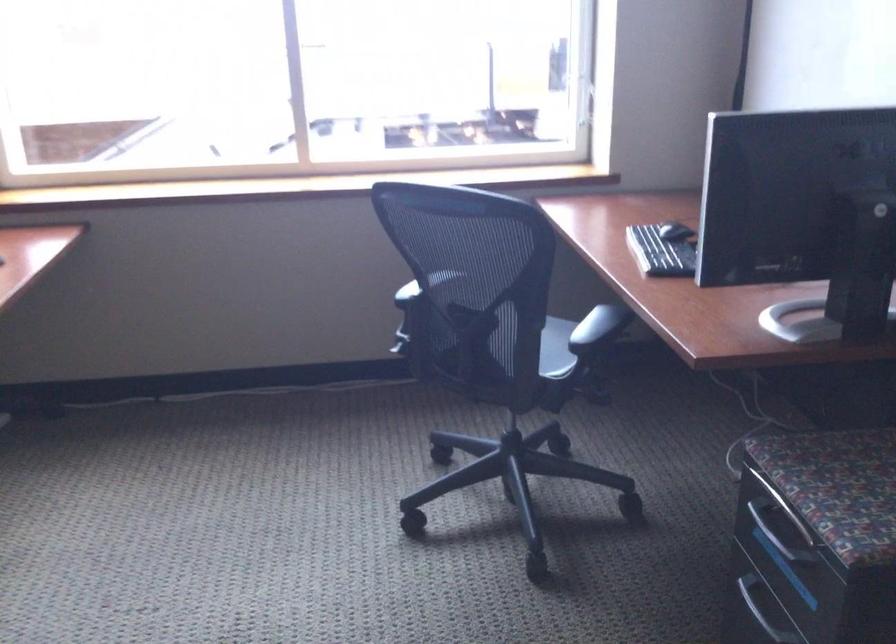
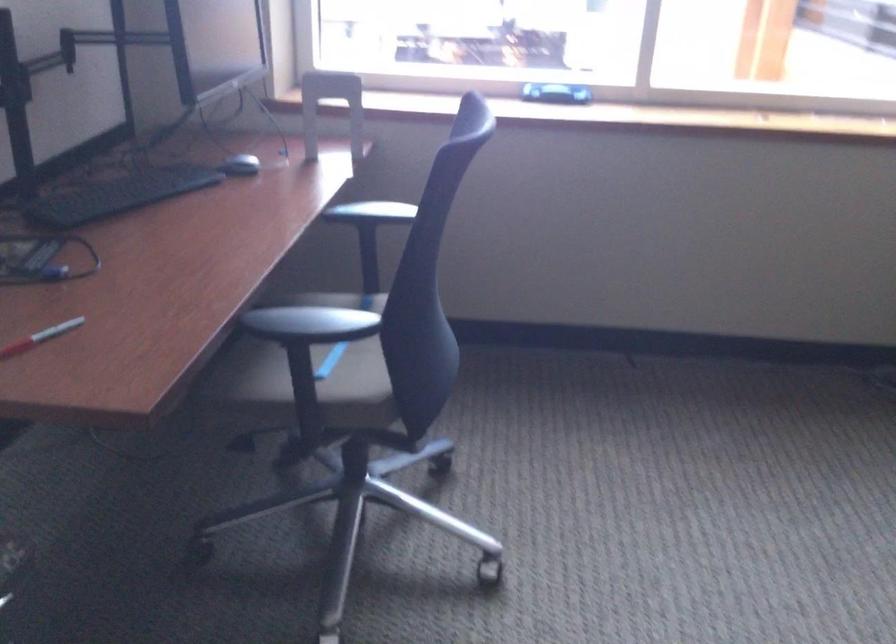
Question: The images are taken continuously from a first-person perspective. In which direction are you moving?

Choices:
 (A) Left
 (B) Right
 (C) Forward
 (D) Backward

Answer: (B)